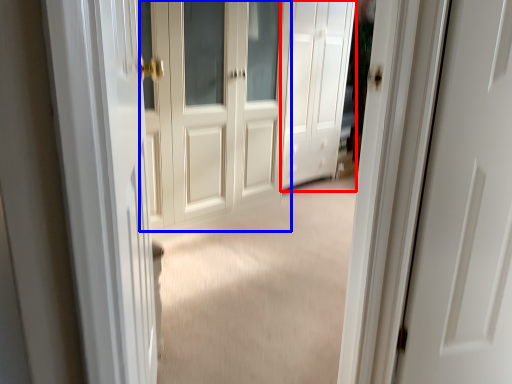
Question: Among these objects, which one is nearest to the camera, door (highlighted by a red box) or door (highlighted by a blue box)?

Choices:
 (A) door
 (B) door

Answer: (B)